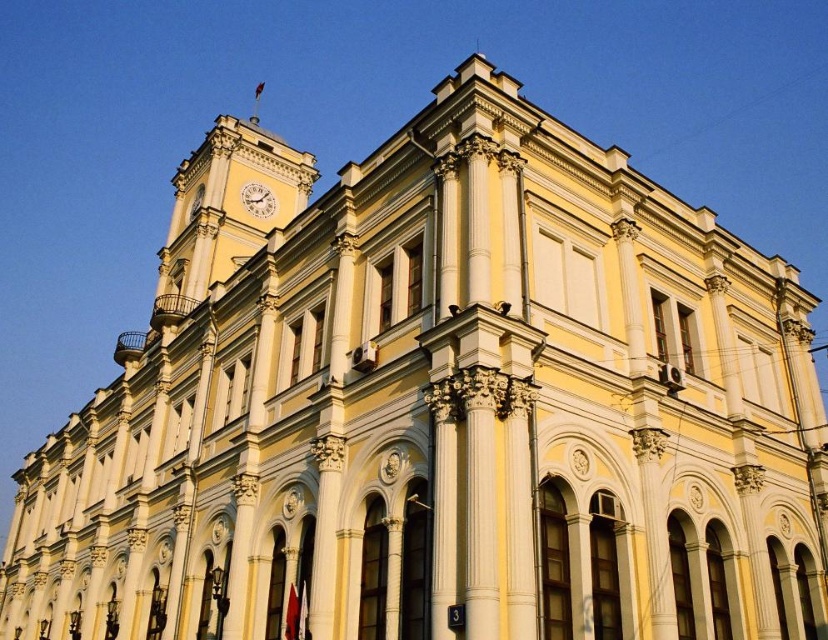
Is yellow stone clock tower at upper left positioned at the back of white glossy clock at upper center?

No, yellow stone clock tower at upper left is closer to the viewer.

The width and height of the screenshot is (828, 640). Find the location of `yellow stone clock tower at upper left`. yellow stone clock tower at upper left is located at coordinates 224,211.